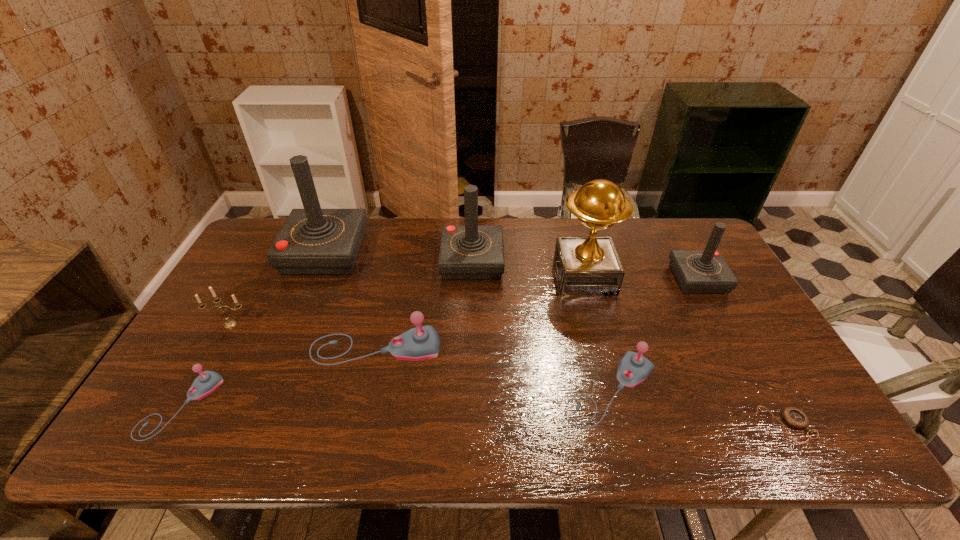
Find the location of `the biggest red joystick`. the biggest red joystick is located at coordinates 313,241.

The image size is (960, 540). Identify the location of the leftmost red joystick. (313, 241).

Identify the location of gold award. This screenshot has height=540, width=960. point(589,265).

Where is `the seventh shortest object`? The height and width of the screenshot is (540, 960). the seventh shortest object is located at coordinates (467, 252).

You are a GUI agent. You are given a task and a screenshot of the screen. Output one action in this format:
    pyautogui.click(x=<x>, y=<y>)
    Task: Click on the fifth shortest joystick
    Image resolution: width=960 pixels, height=540 pixels.
    Given the screenshot: What is the action you would take?
    pyautogui.click(x=467, y=252)

Find the location of a particular element. Image resolution: width=960 pixels, height=540 pixels. the rightmost joystick is located at coordinates (705, 271).

At what (x,y) coordinates should I click in order to perform the action: click on the third tallest joystick. Please return your answer as a coordinate pair (x, y). The image size is (960, 540). Looking at the image, I should click on (705, 271).

Find the location of `metallic candle`. metallic candle is located at coordinates (230, 323).

Where is `the fifth nearest object`? This screenshot has height=540, width=960. the fifth nearest object is located at coordinates (230, 323).

Image resolution: width=960 pixels, height=540 pixels. Find the location of `the fourth tallest joystick`. the fourth tallest joystick is located at coordinates click(423, 342).